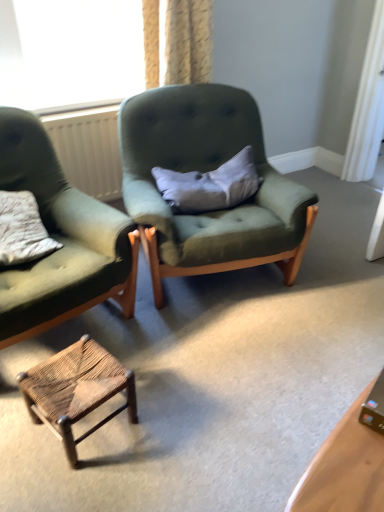
Question: From the image's perspective, is gray fabric pillow at center positioned above or below velvet green armchair at center, acting as the first chair starting from the right?

Choices:
 (A) below
 (B) above

Answer: (B)

Question: Considering the positions of gray fabric pillow at center and velvet green armchair at center, acting as the first chair starting from the right, in the image, is gray fabric pillow at center wider or thinner than velvet green armchair at center, acting as the first chair starting from the right,?

Choices:
 (A) wide
 (B) thin

Answer: (B)

Question: Which of these objects is positioned farthest from the white plastic radiator at left?

Choices:
 (A) textured beige curtain at upper center
 (B) gray fabric pillow at center
 (C) rustic woven stool at lower center
 (D) matte green fabric chair at left, acting as the 2th chair starting from the right
 (E) velvet green armchair at center, acting as the first chair starting from the right

Answer: (C)

Question: Which object is the closest to the gray fabric pillow at center?

Choices:
 (A) rustic woven stool at lower center
 (B) velvet green armchair at center, acting as the 2th chair starting from the left
 (C) textured beige curtain at upper center
 (D) white plastic radiator at left
 (E) matte green fabric chair at left, the 1th chair when ordered from left to right

Answer: (B)